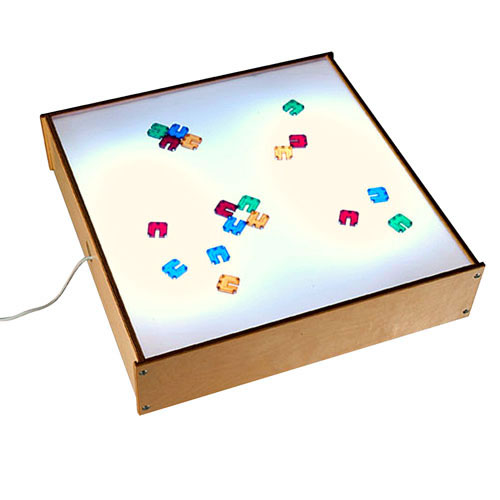
This screenshot has width=500, height=500. Identify the location of lower left light box corner. (143, 359).